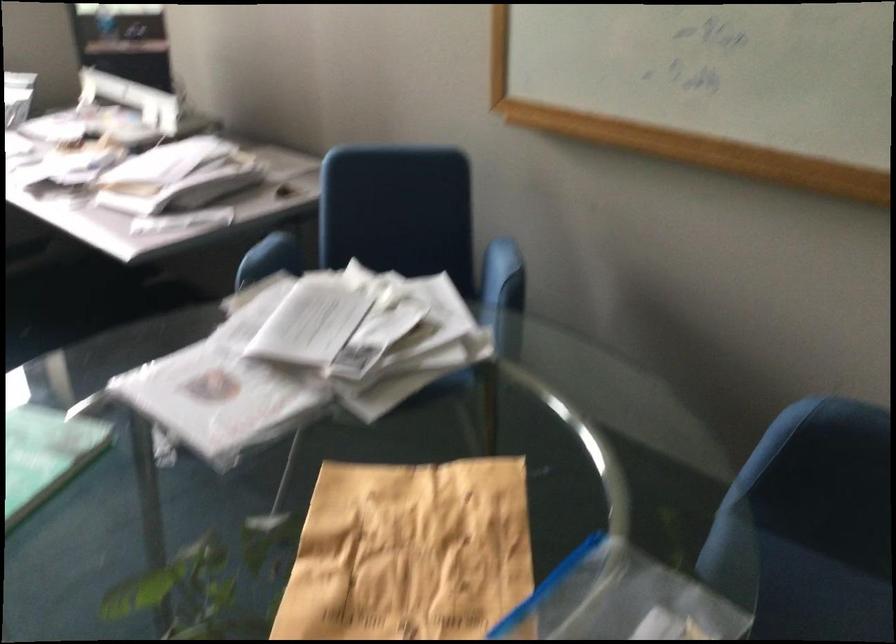
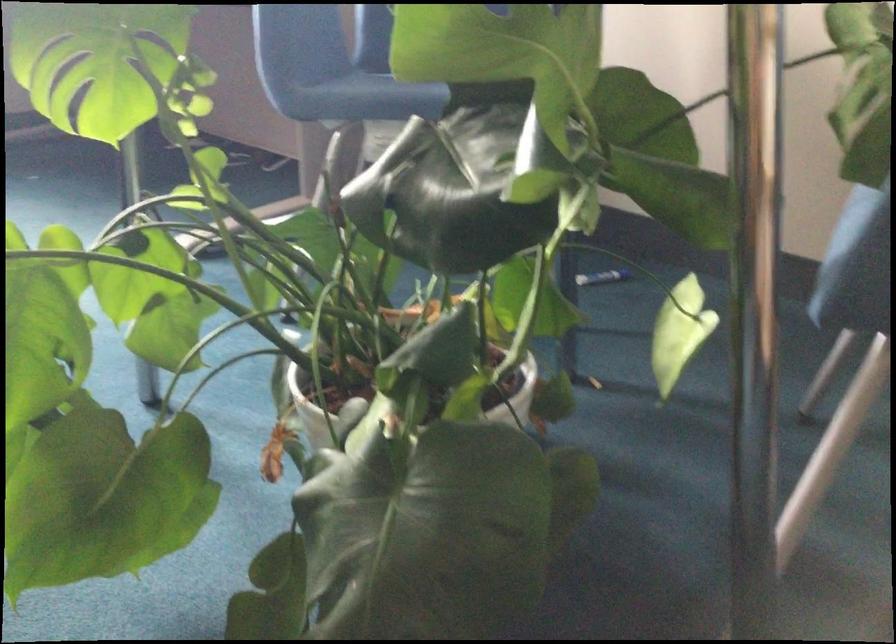
Question: The camera is either moving clockwise (left) or counter-clockwise (right) around the object. The first image is from the beginning of the video and the second image is from the end. Is the camera moving left or right when shooting the video?

Choices:
 (A) Left
 (B) Right

Answer: (B)